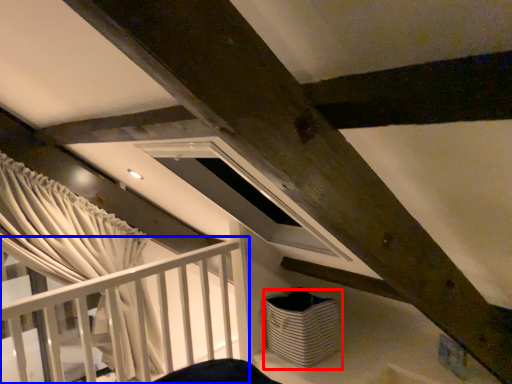
Question: Which object appears farthest to the camera in this image, basket (highlighted by a red box) or rail (highlighted by a blue box)?

Choices:
 (A) basket
 (B) rail

Answer: (A)